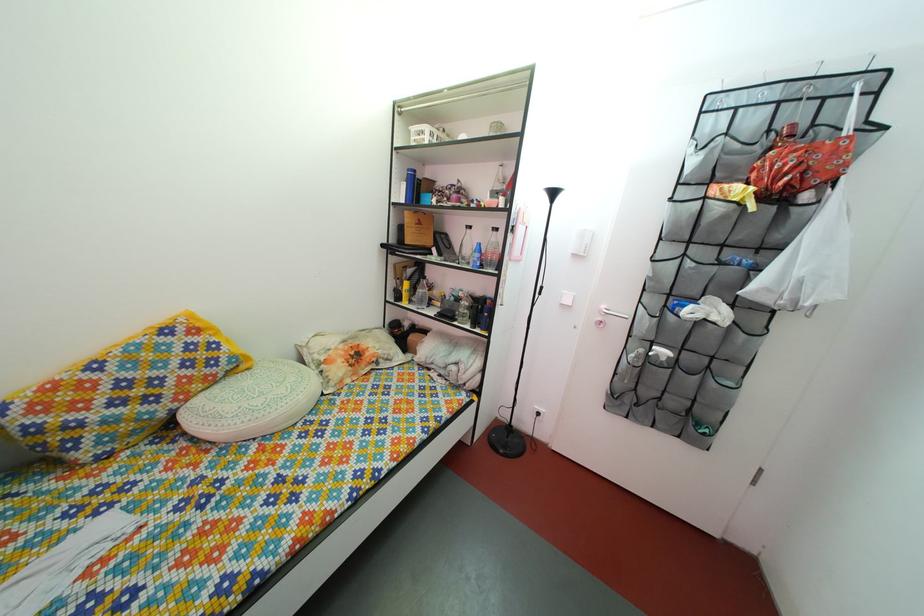
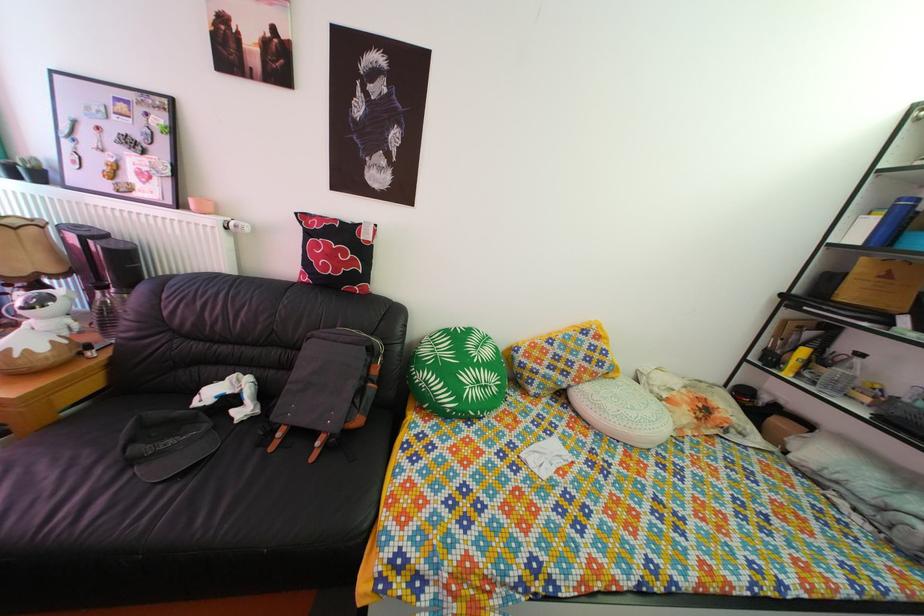
In the second image, find the point that corresponds to point (94, 379) in the first image.

(555, 351)